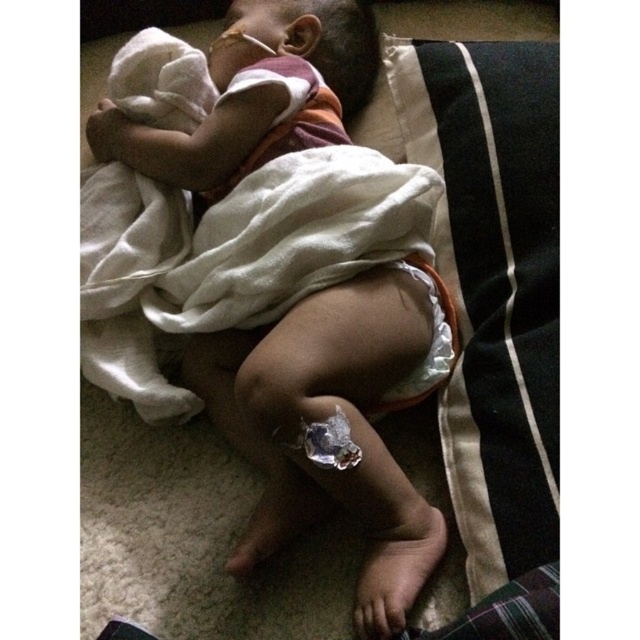
Question: Considering the real-world distances, which object is closest to the black fabric pillow at center?

Choices:
 (A) white cloth diaper at lower center
 (B) orange diaper at center

Answer: (A)

Question: Considering the real-world distances, which object is closest to the orange diaper at center?

Choices:
 (A) white cloth diaper at lower center
 (B) black fabric pillow at center

Answer: (B)

Question: Does orange diaper at center have a smaller size compared to black fabric pillow at center?

Choices:
 (A) yes
 (B) no

Answer: (B)

Question: Does orange diaper at center come in front of white cloth diaper at lower center?

Choices:
 (A) yes
 (B) no

Answer: (A)

Question: Which of these objects is positioned closest to the orange diaper at center?

Choices:
 (A) white cloth diaper at lower center
 (B) black fabric pillow at center

Answer: (B)

Question: Does orange diaper at center have a larger size compared to black fabric pillow at center?

Choices:
 (A) yes
 (B) no

Answer: (A)